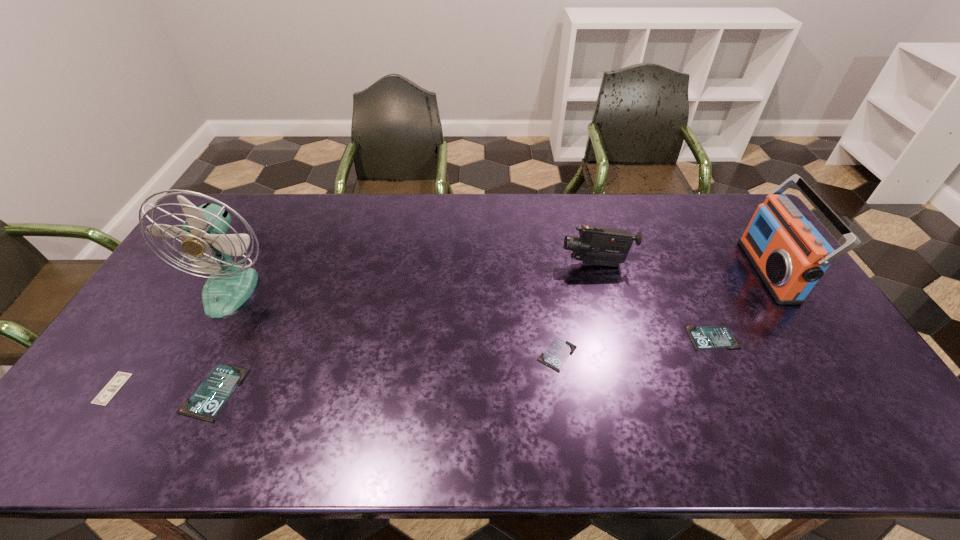
This screenshot has width=960, height=540. I want to click on blank space located 0.280m on the front-facing side of the rightmost object, so click(665, 271).

The height and width of the screenshot is (540, 960). Identify the location of blank area located 0.070m on the back of the shortest object. (138, 350).

Where is `identity card located at the near edge`? The width and height of the screenshot is (960, 540). identity card located at the near edge is located at coordinates (210, 396).

The image size is (960, 540). In order to click on money at the near edge in this screenshot , I will do `click(108, 392)`.

I want to click on fan located at the left edge, so [x=230, y=284].

Identify the location of money at the left edge. (108, 392).

Where is `object at the right edge`? The image size is (960, 540). object at the right edge is located at coordinates (789, 254).

The height and width of the screenshot is (540, 960). What are the coordinates of `object positioned at the near left corner` in the screenshot? It's located at (108, 392).

In order to click on blank space at the far edge in this screenshot , I will do `click(507, 223)`.

The height and width of the screenshot is (540, 960). Find the location of `vacant space at the near edge of the desktop`. vacant space at the near edge of the desktop is located at coordinates (591, 380).